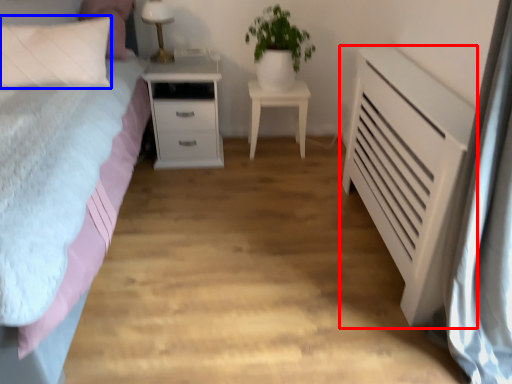
Question: Which object is further to the camera taking this photo, chest of drawers (highlighted by a red box) or pillow (highlighted by a blue box)?

Choices:
 (A) chest of drawers
 (B) pillow

Answer: (B)